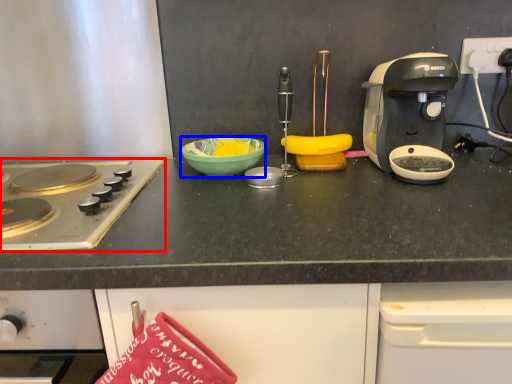
Question: Among these objects, which one is farthest to the camera, gas stove (highlighted by a red box) or bowl (highlighted by a blue box)?

Choices:
 (A) gas stove
 (B) bowl

Answer: (B)